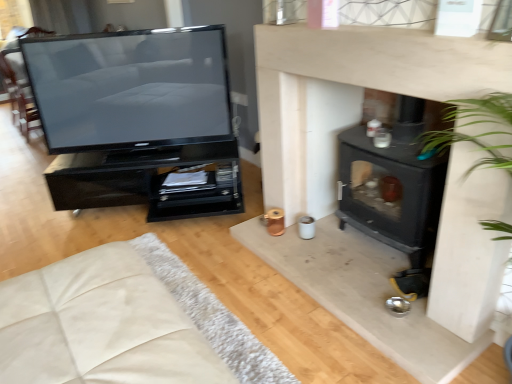
Question: From a real-world perspective, is black matte wood burning stove at center-right under black glossy tv stand at left?

Choices:
 (A) no
 (B) yes

Answer: (A)

Question: Does black matte wood burning stove at center-right turn towards black glossy tv stand at left?

Choices:
 (A) yes
 (B) no

Answer: (B)

Question: Would you say black matte wood burning stove at center-right is outside black glossy tv stand at left?

Choices:
 (A) no
 (B) yes

Answer: (B)

Question: Considering the relative sizes of black matte wood burning stove at center-right and black glossy tv stand at left in the image provided, is black matte wood burning stove at center-right shorter than black glossy tv stand at left?

Choices:
 (A) no
 (B) yes

Answer: (A)

Question: Is black matte wood burning stove at center-right bigger than black glossy tv stand at left?

Choices:
 (A) no
 (B) yes

Answer: (A)

Question: Does black matte wood burning stove at center-right appear on the right side of black glossy tv stand at left?

Choices:
 (A) no
 (B) yes

Answer: (B)

Question: From a real-world perspective, is beige fabric couch at lower left over matte black television at left?

Choices:
 (A) no
 (B) yes

Answer: (A)

Question: Can you confirm if beige fabric couch at lower left is thinner than matte black television at left?

Choices:
 (A) no
 (B) yes

Answer: (A)

Question: From the image's perspective, is beige fabric couch at lower left located beneath matte black television at left?

Choices:
 (A) yes
 (B) no

Answer: (A)

Question: Is beige fabric couch at lower left positioned with its back to matte black television at left?

Choices:
 (A) yes
 (B) no

Answer: (B)

Question: Considering the relative sizes of beige fabric couch at lower left and matte black television at left in the image provided, is beige fabric couch at lower left shorter than matte black television at left?

Choices:
 (A) yes
 (B) no

Answer: (A)

Question: Does beige fabric couch at lower left have a smaller size compared to matte black television at left?

Choices:
 (A) no
 (B) yes

Answer: (A)

Question: From a real-world perspective, is black glossy tv stand at left under matte black television at left?

Choices:
 (A) yes
 (B) no

Answer: (A)